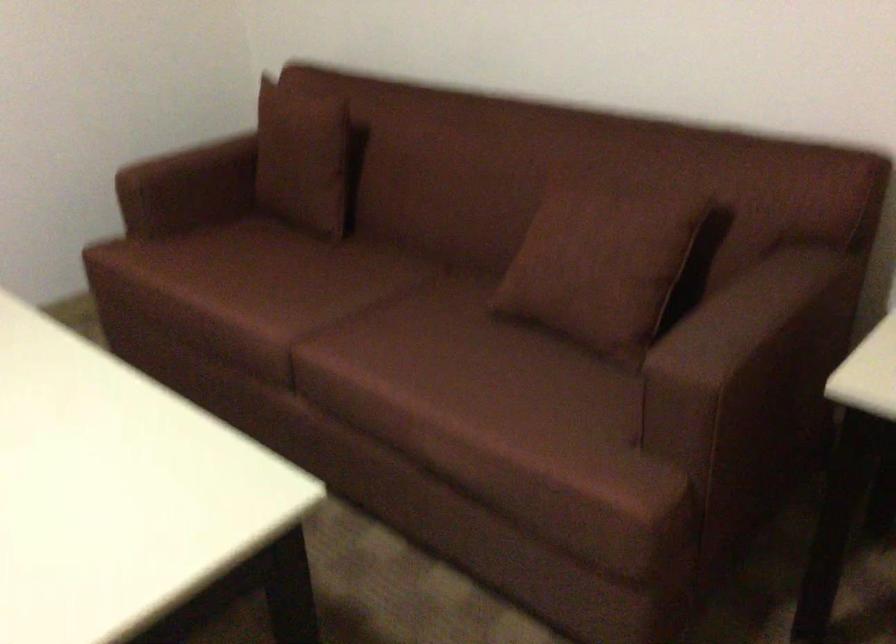
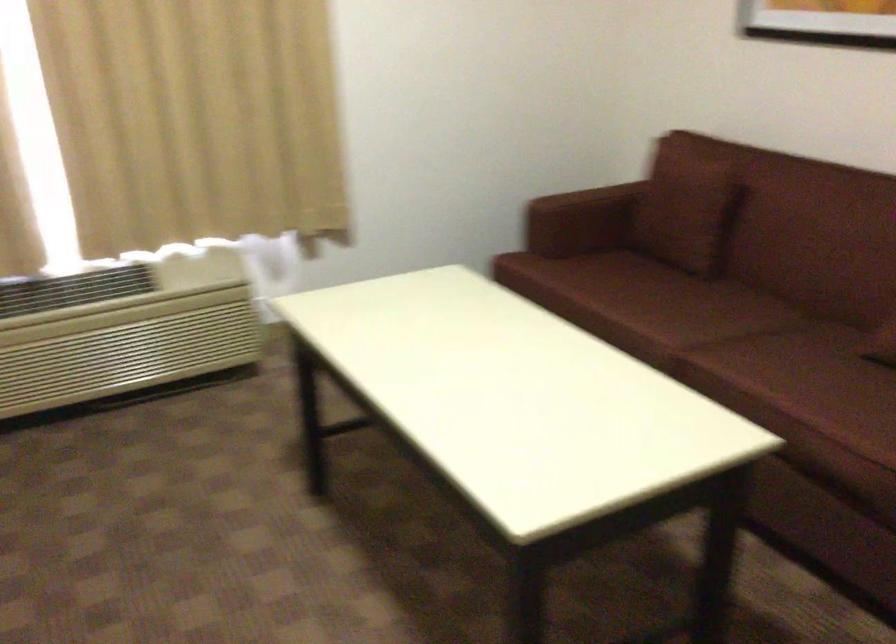
What movement of the cameraman would produce the second image?

The cameraman moved toward left, backward.